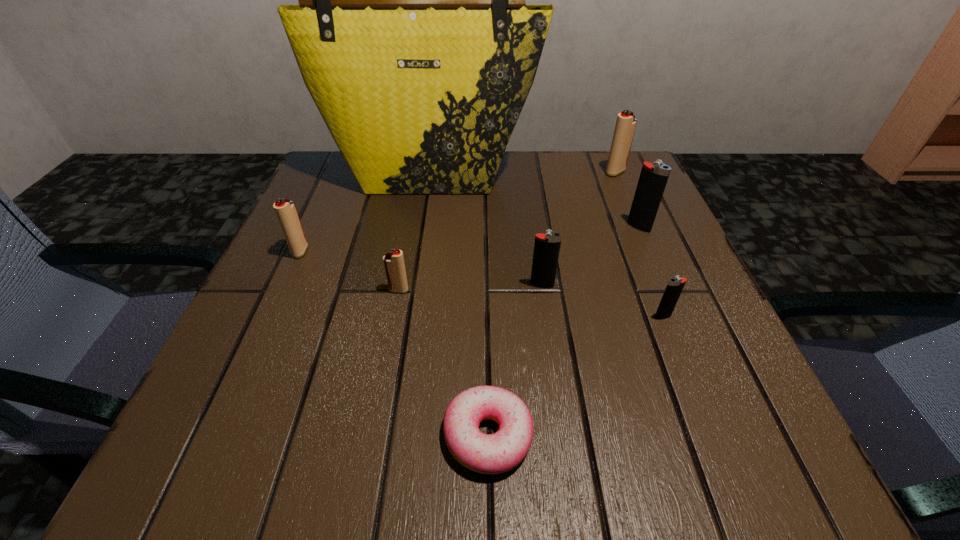
The height and width of the screenshot is (540, 960). In order to click on tote bag in this screenshot , I will do `click(412, 36)`.

The image size is (960, 540). In order to click on yellow tote bag in this screenshot , I will do `click(412, 36)`.

Identify the location of the biggest red igniter. This screenshot has width=960, height=540. (625, 127).

What are the coordinates of `the rightmost red igniter` in the screenshot? It's located at (625, 127).

Identify the location of the sixth nearest object. This screenshot has width=960, height=540. (653, 178).

The image size is (960, 540). Identify the location of the farthest black igniter. [653, 178].

The height and width of the screenshot is (540, 960). I want to click on the second smallest black igniter, so click(x=547, y=246).

Image resolution: width=960 pixels, height=540 pixels. I want to click on the second farthest black igniter, so click(547, 246).

This screenshot has height=540, width=960. Identify the location of the leftmost igniter. (285, 210).

This screenshot has height=540, width=960. In order to click on the second farthest red igniter in this screenshot , I will do coord(285,210).